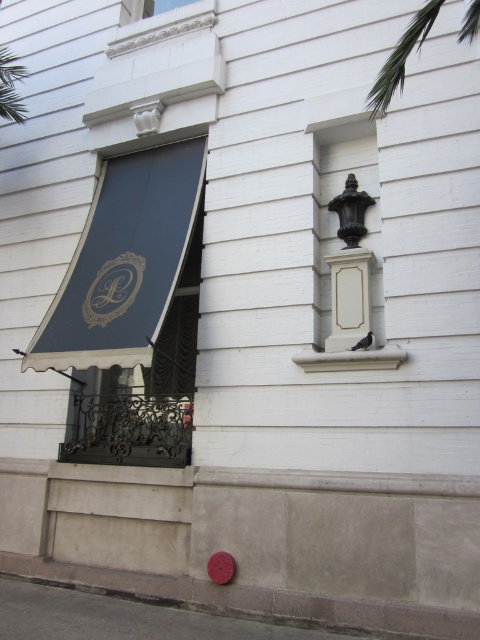
You are a painter standing on a ladder in front of the building. You need to paint the dark blue fabric awning at left and the green leafy palm tree at upper right. Given that your ladder is 8 feet tall, can you reach both objects without moving the ladder?

The dark blue fabric awning at left and green leafy palm tree at upper right are 9.07 feet apart. Since the ladder is only 8 feet tall, you cannot reach both objects without moving the ladder because the distance between them exceeds the ladder height.

You are an architect designing a garden for this building. You want to place a new shrub that is the same size as the green leafy palm tree at upper right. Will the space where the white stone window sill at center is located be big enough to accommodate the shrub?

The green leafy palm tree at upper right is larger in size than the white stone window sill at center. Therefore, the space where the white stone window sill at center is located may not be large enough to accommodate the shrub of the same size as the palm tree.

You are standing in front of the building and notice the green leafy palm tree at upper right and the white stone window sill at center. Which object is taller?

The green leafy palm tree at upper right is much taller than the white stone window sill at center.